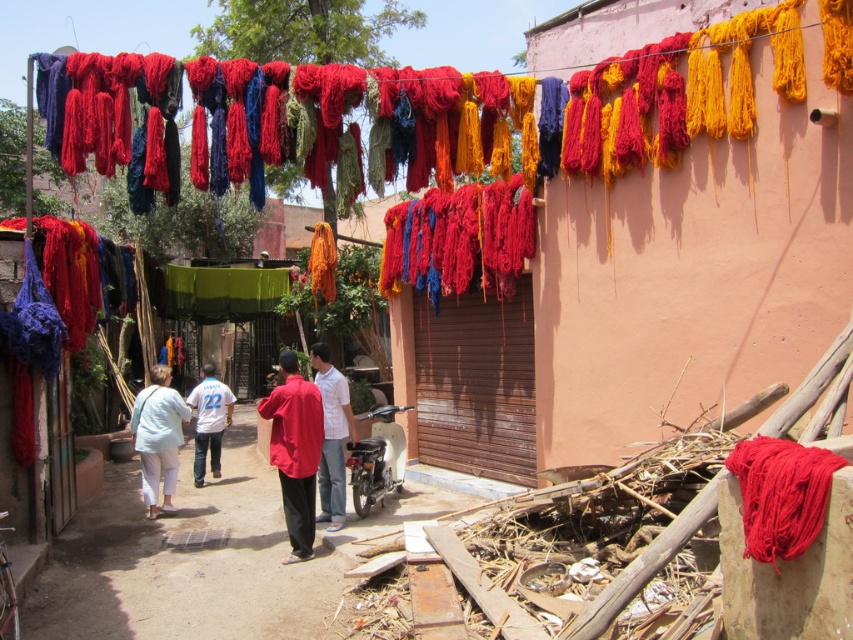
Question: Can you confirm if matte red clothing at center is wider than matte white shirt at center?

Choices:
 (A) yes
 (B) no

Answer: (A)

Question: Which is farther from the matte red clothing at center?

Choices:
 (A) matte white shirt at center
 (B) white jersey at center

Answer: (B)

Question: Which object is farther from the camera taking this photo?

Choices:
 (A) white jersey at center
 (B) light blue cotton pants at center
 (C) matte red shirt at center
 (D) matte red clothing at center

Answer: (A)

Question: Is matte red shirt at center to the left of matte white shirt at center from the viewer's perspective?

Choices:
 (A) yes
 (B) no

Answer: (A)

Question: Is light blue cotton pants at center in front of matte white shirt at center?

Choices:
 (A) yes
 (B) no

Answer: (B)

Question: Which point appears farthest from the camera in this image?

Choices:
 (A) (276, 467)
 (B) (164, 429)
 (C) (212, 374)
 (D) (325, 342)

Answer: (D)